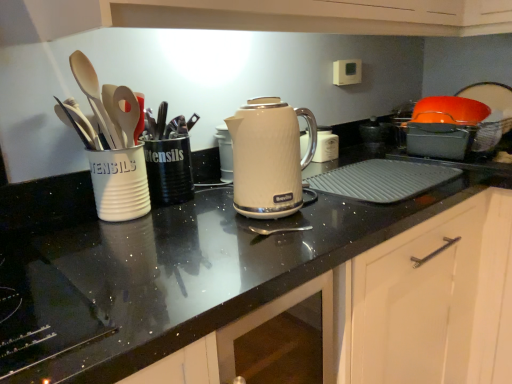
Question: From the image's perspective, is matte white kettle at center above or below white glossy electric kettle at center?

Choices:
 (A) above
 (B) below

Answer: (B)

Question: Based on their positions, is matte white kettle at center located to the left or right of white glossy electric kettle at center?

Choices:
 (A) right
 (B) left

Answer: (B)

Question: Which object is the closest to the white glossy cabinet at center, placed as the first cabinetry when sorted from left to right?

Choices:
 (A) white matte cabinet door at lower right, which is counted as the first cabinetry, starting from the right
 (B) matte white kettle at center
 (C) white matte utensils cup at left, which ranks as the second tableware in right-to-left order
 (D) black plastic utensils at center, which appears as the first tableware when viewed from the right
 (E) white glossy electric kettle at center

Answer: (A)

Question: Which object is positioned farthest from the white matte cabinet door at lower right, the 2th cabinetry positioned from the front?

Choices:
 (A) white glossy cabinet at center, placed as the first cabinetry when sorted from left to right
 (B) white matte utensils cup at left, which ranks as the second tableware in right-to-left order
 (C) black plastic utensils at center, placed as the 2th tableware when sorted from left to right
 (D) white glossy electric kettle at center
 (E) matte white kettle at center

Answer: (B)